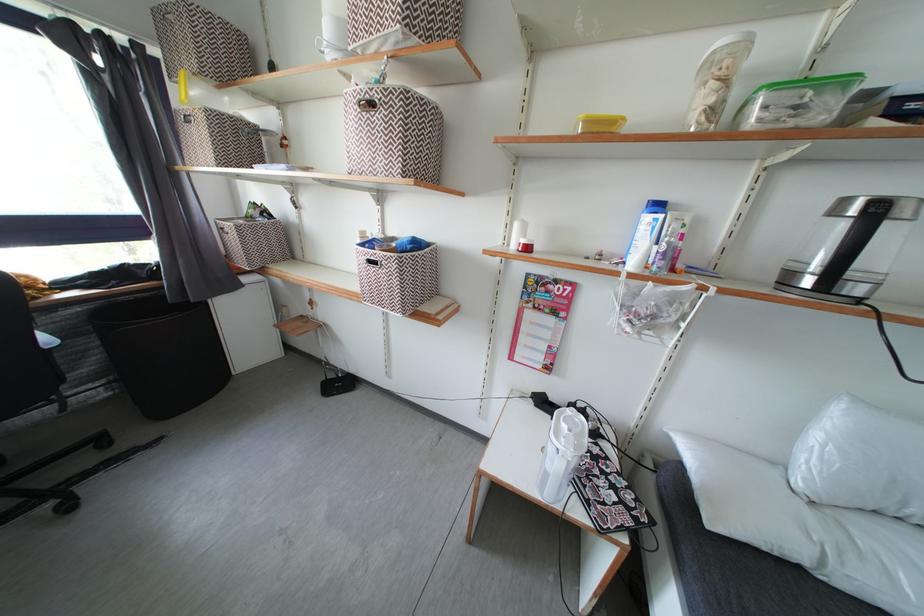
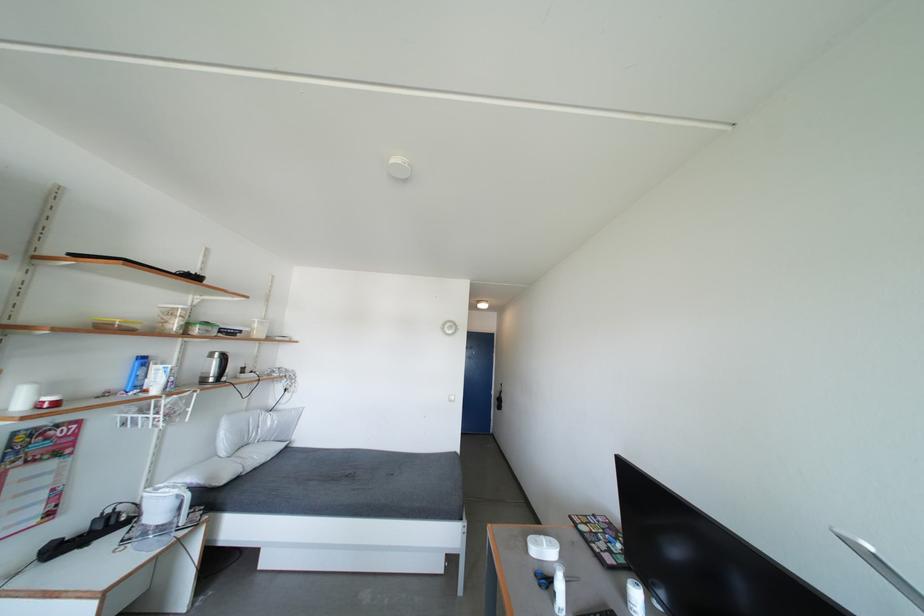
Where in the second image is the point corresponding to [822,440] from the first image?

(228, 439)